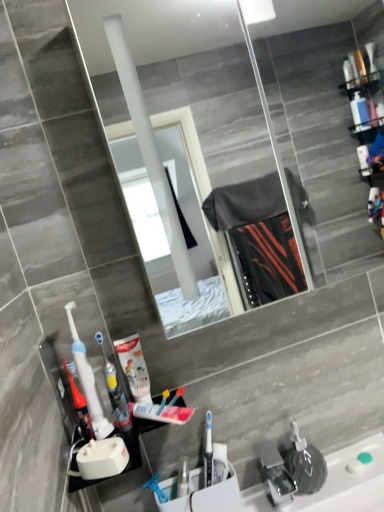
Question: From the image's perspective, does white plastic toothbrush holder at lower center, which is counted as the second sink, starting from the right, appear lower than white glossy toothpaste tube at center?

Choices:
 (A) no
 (B) yes

Answer: (B)

Question: From a real-world perspective, is white plastic toothbrush holder at lower center, which is counted as the second sink, starting from the right, physically above white glossy toothpaste tube at center?

Choices:
 (A) no
 (B) yes

Answer: (A)

Question: Is white plastic toothbrush holder at lower center, the first sink from the left, next to white glossy toothpaste tube at center?

Choices:
 (A) yes
 (B) no

Answer: (B)

Question: Are white plastic toothbrush holder at lower center, which is counted as the second sink, starting from the right, and white glossy toothpaste tube at center far apart?

Choices:
 (A) no
 (B) yes

Answer: (A)

Question: Considering the relative sizes of white plastic toothbrush holder at lower center, the first sink from the left, and white glossy toothpaste tube at center in the image provided, is white plastic toothbrush holder at lower center, the first sink from the left, taller than white glossy toothpaste tube at center?

Choices:
 (A) yes
 (B) no

Answer: (B)

Question: In terms of width, does translucent plastic mouthwash at lower left look wider or thinner when compared to white plastic toothbrush holder at lower center, which is counted as the second sink, starting from the right?

Choices:
 (A) wide
 (B) thin

Answer: (B)

Question: From the image's perspective, is translucent plastic mouthwash at lower left positioned above or below white plastic toothbrush holder at lower center, the first sink from the left?

Choices:
 (A) above
 (B) below

Answer: (A)

Question: Is translucent plastic mouthwash at lower left in front of or behind white plastic toothbrush holder at lower center, the first sink from the left, in the image?

Choices:
 (A) behind
 (B) front

Answer: (B)

Question: Is point coord(87,417) positioned closer to the camera than point coord(236,494)?

Choices:
 (A) closer
 (B) farther

Answer: (A)

Question: In terms of height, does white plastic toothbrush at center, which appears as the 2th toothbrush when viewed from the left, look taller or shorter compared to translucent plastic toothbrush at left, the 1th toothbrush in the left-to-right sequence?

Choices:
 (A) short
 (B) tall

Answer: (A)

Question: From a real-world perspective, relative to translucent plastic toothbrush at left, placed as the 2th toothbrush when sorted from right to left, is white plastic toothbrush at center, which appears as the 2th toothbrush when viewed from the left, vertically above or below?

Choices:
 (A) above
 (B) below

Answer: (B)

Question: Considering the positions of white plastic toothbrush at center, arranged as the 1th toothbrush when viewed from the right, and translucent plastic toothbrush at left, placed as the 2th toothbrush when sorted from right to left, in the image, is white plastic toothbrush at center, arranged as the 1th toothbrush when viewed from the right, wider or thinner than translucent plastic toothbrush at left, placed as the 2th toothbrush when sorted from right to left,?

Choices:
 (A) wide
 (B) thin

Answer: (B)

Question: Choose the correct answer: Is white plastic toothbrush at center, which appears as the 2th toothbrush when viewed from the left, inside translucent plastic toothbrush at left, the 1th toothbrush in the left-to-right sequence, or outside it?

Choices:
 (A) outside
 (B) inside

Answer: (A)

Question: Considering the positions of translucent plastic toothbrush at left, the 1th toothbrush in the left-to-right sequence, and white plastic toothbrush at center, which appears as the 2th toothbrush when viewed from the left, in the image, is translucent plastic toothbrush at left, the 1th toothbrush in the left-to-right sequence, taller or shorter than white plastic toothbrush at center, which appears as the 2th toothbrush when viewed from the left,?

Choices:
 (A) tall
 (B) short

Answer: (A)

Question: From the image's perspective, is translucent plastic toothbrush at left, placed as the 2th toothbrush when sorted from right to left, located above or below white plastic toothbrush at center, arranged as the 1th toothbrush when viewed from the right?

Choices:
 (A) above
 (B) below

Answer: (A)